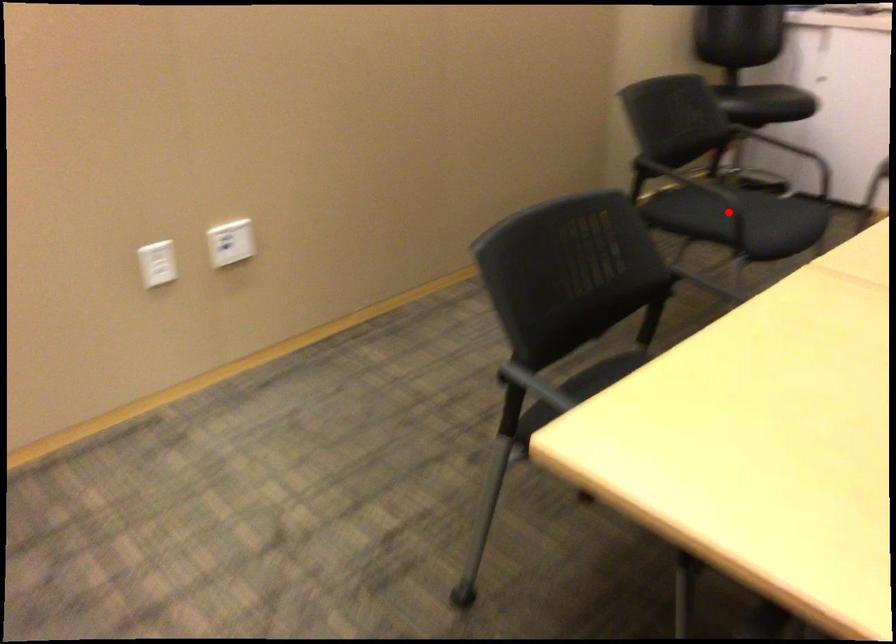
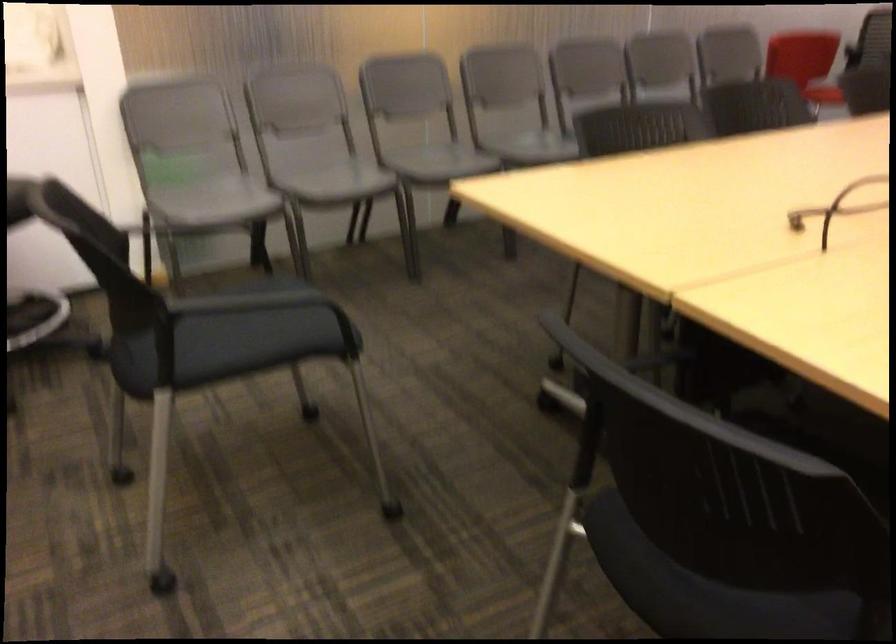
Where in the second image is the point corresponding to the highlighted location from the first image?

(235, 336)